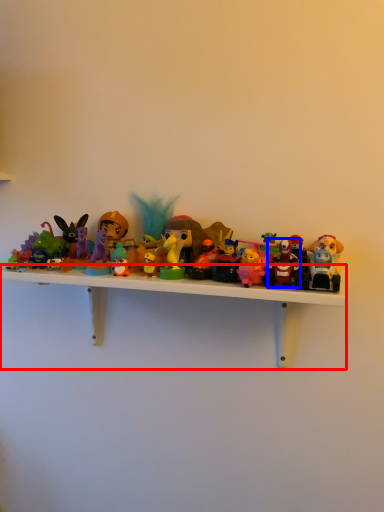
Question: Which of the following is the farthest to the observer, shelf (highlighted by a red box) or toy (highlighted by a blue box)?

Choices:
 (A) shelf
 (B) toy

Answer: (B)